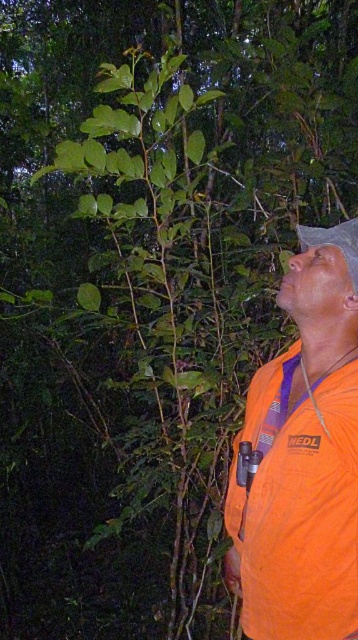
You are standing in the forest and want to determine which of the two points, point (342, 586) or point (331, 244), is closer to you. Based on the scene, which point is nearer?

Point (342, 586) is closer to the viewer than point (331, 244).

You are a hiker in the forest and notice two items in your view. You see the orange fabric shirt at right and the white matte hat at upper right. Which item is positioned higher up in the image?

The white matte hat at upper right is positioned higher up in the image than the orange fabric shirt at right.